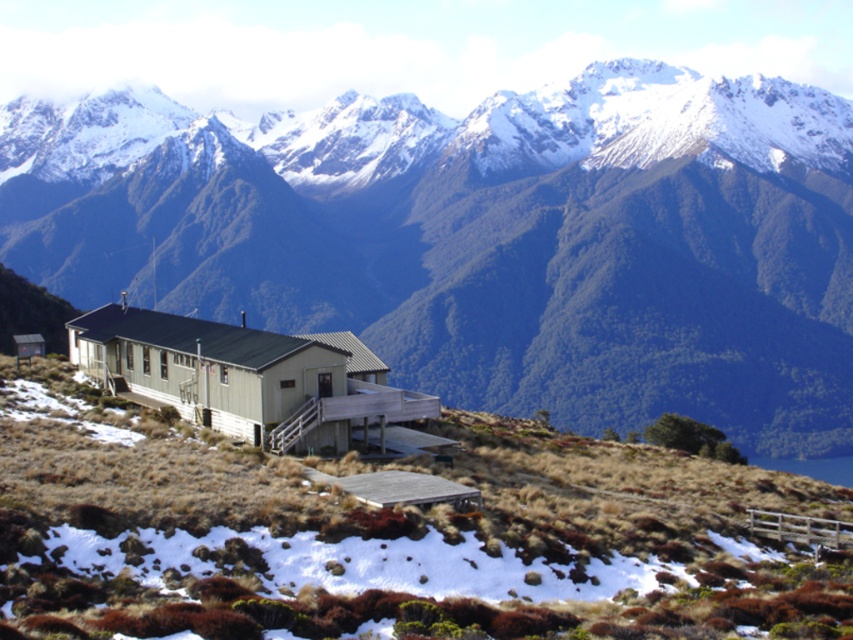
Is snowy rock mountain range at upper center smaller than green wood hillside at center?

Incorrect, snowy rock mountain range at upper center is not smaller in size than green wood hillside at center.

Is snowy rock mountain range at upper center taller than green wood hillside at center?

Indeed, snowy rock mountain range at upper center has a greater height compared to green wood hillside at center.

You are a GUI agent. You are given a task and a screenshot of the screen. Output one action in this format:
    pyautogui.click(x=<x>, y=<y>)
    Task: Click on the snowy rock mountain range at upper center
    The image size is (853, 640).
    Given the screenshot: What is the action you would take?
    pos(486,237)